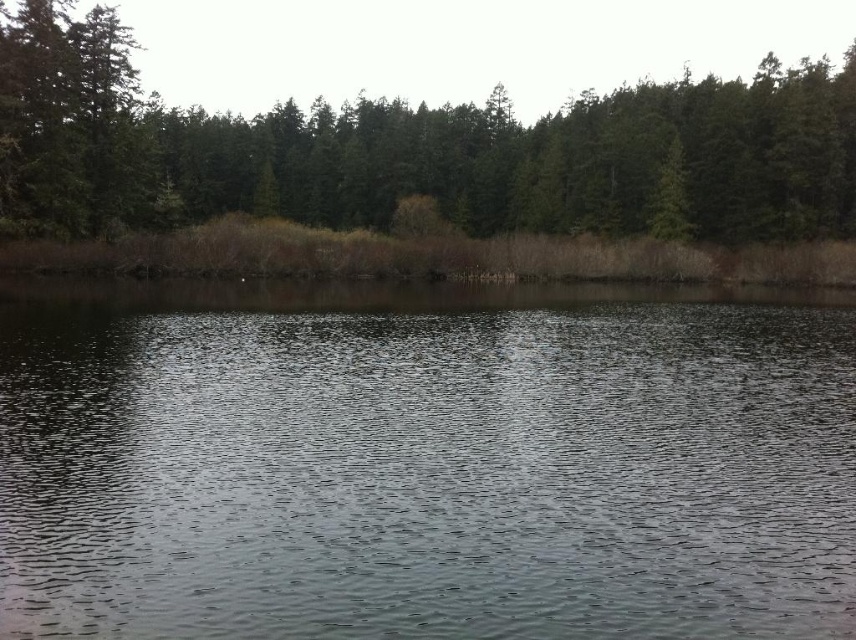
Question: Which of the following is the farthest from the observer?

Choices:
 (A) green matte trees at upper center
 (B) clear water at center

Answer: (A)

Question: Which point is closer to the camera?

Choices:
 (A) clear water at center
 (B) green matte trees at upper center

Answer: (A)

Question: Does clear water at center appear on the right side of green matte trees at upper center?

Choices:
 (A) no
 (B) yes

Answer: (B)

Question: From the image, what is the correct spatial relationship of clear water at center in relation to green matte trees at upper center?

Choices:
 (A) right
 (B) left

Answer: (A)

Question: Which point is closer to the camera?

Choices:
 (A) (134, 176)
 (B) (492, 291)

Answer: (B)

Question: Can you confirm if clear water at center is positioned above green matte trees at upper center?

Choices:
 (A) yes
 (B) no

Answer: (B)